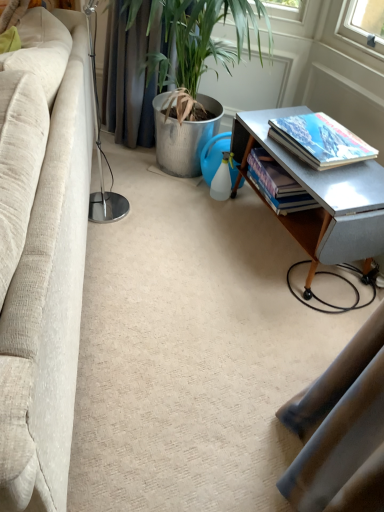
This screenshot has height=512, width=384. Describe the element at coordinates (322, 196) in the screenshot. I see `metallic gray table at right` at that location.

In order to face hardcover book at right, acting as the second book starting from the back, should I rotate leftwards or rightwards?

To align with it, rotate right about 16.448°.

Identify the location of hardcover book at right, which appears as the 1th book when viewed from the back. (277, 184).

What is the approximate height of hardcover book at right, which appears as the 1th book when viewed from the back?

5.68 inches.

What is the approximate width of beige fabric couch at left?

It is 22.07 inches.

Identify the location of metallic gray table at right. Image resolution: width=384 pixels, height=512 pixels. 322,196.

From a real-world perspective, between metallic gray table at right and hardcover book at right, acting as the second book starting from the back, who is vertically lower?

In real-world perspective, metallic gray table at right is lower.

From their relative heights in the image, would you say metallic gray table at right is taller or shorter than hardcover book at right, acting as the second book starting from the back?

In the image, metallic gray table at right appears to be taller than hardcover book at right, acting as the second book starting from the back.

Based on the photo, does metallic gray table at right come behind hardcover book at right, the first book positioned from the front?

No, the depth of metallic gray table at right is less than that of hardcover book at right, the first book positioned from the front.

In terms of size, does metallic gray table at right appear bigger or smaller than hardcover book at right, the first book positioned from the front?

Clearly, metallic gray table at right is larger in size than hardcover book at right, the first book positioned from the front.

Which point is more forward, (291, 108) or (59, 244)?

The point (59, 244) is closer to the camera.

Is metallic gray table at right oriented towards beige fabric couch at left?

Yes, metallic gray table at right is aimed at beige fabric couch at left.

From a real-world perspective, is metallic gray table at right physically below beige fabric couch at left?

Yes, from a real-world perspective, metallic gray table at right is beneath beige fabric couch at left.

Between beige fabric couch at left and hardcover book at right, acting as the second book starting from the back, which one appears on the right side from the viewer's perspective?

hardcover book at right, acting as the second book starting from the back.

Is hardcover book at right, the first book positioned from the front, completely or partially inside beige fabric couch at left?

That's incorrect, hardcover book at right, the first book positioned from the front, is not inside beige fabric couch at left.

From the image's perspective, which is below, beige fabric couch at left or hardcover book at right, the first book positioned from the front?

beige fabric couch at left appears lower in the image.

Who is smaller, beige fabric couch at left or hardcover book at right, acting as the second book starting from the back?

With smaller size is hardcover book at right, acting as the second book starting from the back.

Considering the sizes of objects hardcover book at right, the 2th book viewed from the front, and metallic gray table at right in the image provided, who is shorter, hardcover book at right, the 2th book viewed from the front, or metallic gray table at right?

With less height is hardcover book at right, the 2th book viewed from the front.

Which is more to the left, hardcover book at right, which appears as the 1th book when viewed from the back, or metallic gray table at right?

From the viewer's perspective, hardcover book at right, which appears as the 1th book when viewed from the back, appears more on the left side.

In the scene shown: Considering the sizes of objects hardcover book at right, the 2th book viewed from the front, and metallic gray table at right in the image provided, who is smaller, hardcover book at right, the 2th book viewed from the front, or metallic gray table at right?

hardcover book at right, the 2th book viewed from the front.

Between hardcover book at right, which appears as the 1th book when viewed from the back, and metallic gray table at right, which one has smaller width?

hardcover book at right, which appears as the 1th book when viewed from the back, is thinner.

Is hardcover book at right, which appears as the 1th book when viewed from the back, at the back of beige fabric couch at left?

That's right, beige fabric couch at left is facing away from hardcover book at right, which appears as the 1th book when viewed from the back.

Which is in front, point (70, 301) or point (279, 188)?

The point (70, 301) is closer to the camera.

Between beige fabric couch at left and hardcover book at right, which appears as the 1th book when viewed from the back, which one has smaller width?

With smaller width is hardcover book at right, which appears as the 1th book when viewed from the back.

Is metallic gray table at right next to hardcover book at right, which appears as the 1th book when viewed from the back?

They are not placed beside each other.

Between metallic gray table at right and hardcover book at right, which appears as the 1th book when viewed from the back, which one has smaller width?

hardcover book at right, which appears as the 1th book when viewed from the back, is thinner.

Which is correct: metallic gray table at right is inside hardcover book at right, which appears as the 1th book when viewed from the back, or outside of it?

metallic gray table at right exists outside the volume of hardcover book at right, which appears as the 1th book when viewed from the back.

Considering the sizes of objects metallic gray table at right and hardcover book at right, which appears as the 1th book when viewed from the back, in the image provided, who is smaller, metallic gray table at right or hardcover book at right, which appears as the 1th book when viewed from the back,?

hardcover book at right, which appears as the 1th book when viewed from the back, is smaller.

Does beige fabric couch at left have a smaller size compared to metallic gray table at right?

No.

Is beige fabric couch at left facing towards metallic gray table at right?

No, beige fabric couch at left is not aimed at metallic gray table at right.

You are a GUI agent. You are given a task and a screenshot of the screen. Output one action in this format:
    pyautogui.click(x=<x>, y=<y>)
    Task: Click on the table that appears on the right of beige fabric couch at left
    The width and height of the screenshot is (384, 512).
    Given the screenshot: What is the action you would take?
    pyautogui.click(x=322, y=196)

Between point (40, 407) and point (305, 165), which one is positioned behind?

The point (305, 165) is farther from the camera.

You are a GUI agent. You are given a task and a screenshot of the screen. Output one action in this format:
    pyautogui.click(x=<x>, y=<y>)
    Task: Click on the book on the right side of metallic gray table at right
    
    Given the screenshot: What is the action you would take?
    pyautogui.click(x=320, y=141)

Identify the location of studio couch above the metallic gray table at right (from a real-world perspective). Image resolution: width=384 pixels, height=512 pixels. pyautogui.click(x=42, y=252).

When comparing their distances from beige fabric couch at left, does hardcover book at right, which appears as the 1th book when viewed from the back, or metallic gray table at right seem further?

The object further to beige fabric couch at left is hardcover book at right, which appears as the 1th book when viewed from the back.

Looking at the image, which one is located further to metallic gray table at right, hardcover book at right, the first book positioned from the front, or hardcover book at right, which appears as the 1th book when viewed from the back?

hardcover book at right, which appears as the 1th book when viewed from the back, lies further to metallic gray table at right than the other object.

From the picture: From the image, which object appears to be nearer to hardcover book at right, the first book positioned from the front, metallic gray table at right or beige fabric couch at left?

Based on the image, metallic gray table at right appears to be nearer to hardcover book at right, the first book positioned from the front.

Which object lies nearer to the anchor point hardcover book at right, which appears as the 1th book when viewed from the back, beige fabric couch at left or hardcover book at right, acting as the second book starting from the back?

hardcover book at right, acting as the second book starting from the back, is positioned closer to the anchor hardcover book at right, which appears as the 1th book when viewed from the back.

Estimate the real-world distances between objects in this image. Which object is further from hardcover book at right, the 2th book viewed from the front, metallic gray table at right or hardcover book at right, acting as the second book starting from the back?

Among the two, hardcover book at right, acting as the second book starting from the back, is located further to hardcover book at right, the 2th book viewed from the front.

Considering their positions, is metallic gray table at right positioned further to hardcover book at right, the 2th book viewed from the front, than beige fabric couch at left?

The object further to hardcover book at right, the 2th book viewed from the front, is beige fabric couch at left.

Looking at the image, which one is located closer to metallic gray table at right, beige fabric couch at left or hardcover book at right, acting as the second book starting from the back?

Among the two, hardcover book at right, acting as the second book starting from the back, is located nearer to metallic gray table at right.

Looking at the image, which one is located further to metallic gray table at right, hardcover book at right, the 2th book viewed from the front, or beige fabric couch at left?

beige fabric couch at left is positioned further to the anchor metallic gray table at right.

You are a GUI agent. You are given a task and a screenshot of the screen. Output one action in this format:
    pyautogui.click(x=<x>, y=<y>)
    Task: Click on the table between beige fabric couch at left and hardcover book at right, the first book positioned from the front, in the front-back direction
    The height and width of the screenshot is (512, 384).
    Given the screenshot: What is the action you would take?
    pyautogui.click(x=322, y=196)

This screenshot has height=512, width=384. I want to click on book between metallic gray table at right and hardcover book at right, which appears as the 1th book when viewed from the back, along the z-axis, so click(320, 141).

This screenshot has height=512, width=384. I want to click on book located between beige fabric couch at left and hardcover book at right, the 2th book viewed from the front, in the depth direction, so click(x=320, y=141).

Where is `table between beige fabric couch at left and hardcover book at right, which appears as the 1th book when viewed from the back, along the z-axis`? This screenshot has height=512, width=384. table between beige fabric couch at left and hardcover book at right, which appears as the 1th book when viewed from the back, along the z-axis is located at coordinates (322, 196).